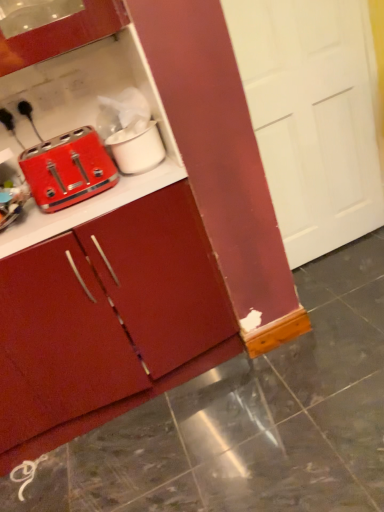
Question: Is matte red toaster at left taller or shorter than white matte pot at upper center?

Choices:
 (A) short
 (B) tall

Answer: (B)

Question: Is matte red toaster at left bigger or smaller than white matte pot at upper center?

Choices:
 (A) big
 (B) small

Answer: (A)

Question: Estimate the real-world distances between objects in this image. Which object is farther from the white matte pot at upper center?

Choices:
 (A) matte red toaster at left
 (B) matte red cabinet at center
 (C) white glossy tile at lower left

Answer: (C)

Question: Estimate the real-world distances between objects in this image. Which object is farther from the matte red cabinet at center?

Choices:
 (A) white matte pot at upper center
 (B) white glossy tile at lower left
 (C) matte red toaster at left

Answer: (B)